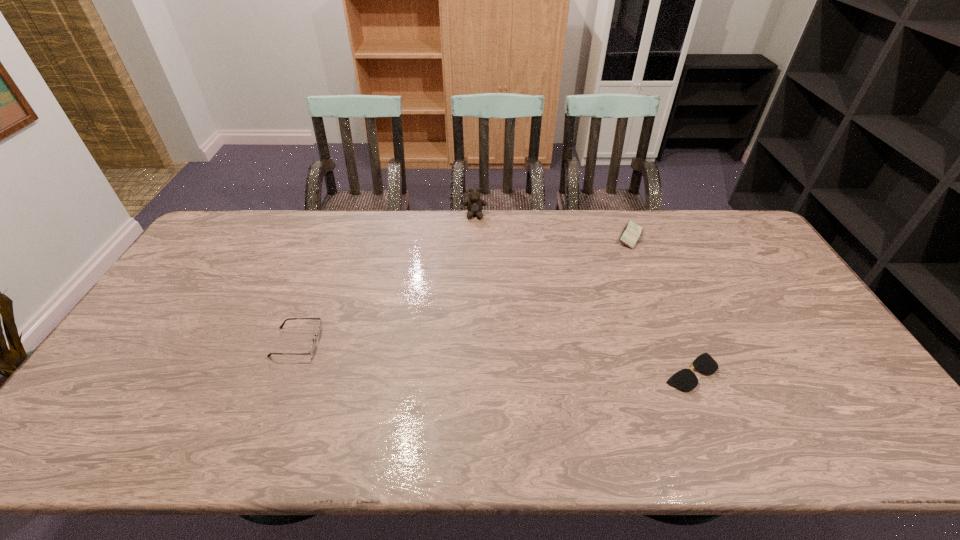
Identify which object is the second nearest to the third shortest object. Please provide its 2D coordinates. Your answer should be formatted as a tuple, i.e. [(x, y)], where the tuple contains the x and y coordinates of a point satisfying the conditions above.

[(474, 204)]

The image size is (960, 540). What are the coordinates of `vacant space that satisfies the following two spatial constraints: 1. on the face of the third object from right to left; 2. on the right side of the diary` in the screenshot? It's located at (474, 237).

Locate an element on the screen. vacant area in the image that satisfies the following two spatial constraints: 1. on the face of the second object from left to right; 2. on the front-facing side of the left spectacles is located at coordinates pos(473,342).

I want to click on vacant region that satisfies the following two spatial constraints: 1. on the face of the teddy bear; 2. on the front-facing side of the left spectacles, so click(473, 342).

This screenshot has height=540, width=960. Identify the location of blank space that satisfies the following two spatial constraints: 1. on the face of the teddy bear; 2. on the right side of the diary. (474, 237).

I want to click on free location that satisfies the following two spatial constraints: 1. on the face of the tallest object; 2. on the right side of the second farthest object, so click(474, 237).

At what (x,y) coordinates should I click in order to perform the action: click on vacant position in the image that satisfies the following two spatial constraints: 1. on the face of the shorter spectacles; 2. on the right side of the third object from right to left. Please return your answer as a coordinate pair (x, y). Image resolution: width=960 pixels, height=540 pixels. Looking at the image, I should click on (472, 372).

Identify the location of free space that satisfies the following two spatial constraints: 1. on the front-facing side of the left spectacles; 2. on the right side of the shortest object. This screenshot has width=960, height=540. (285, 372).